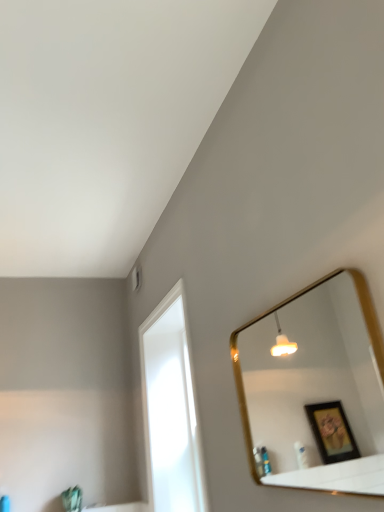
Question: Does gold metallic mirror at upper right have a smaller size compared to transparent glass window at upper left?

Choices:
 (A) yes
 (B) no

Answer: (A)

Question: From the image's perspective, would you say gold metallic mirror at upper right is positioned over transparent glass window at upper left?

Choices:
 (A) yes
 (B) no

Answer: (A)

Question: Is gold metallic mirror at upper right oriented towards transparent glass window at upper left?

Choices:
 (A) no
 (B) yes

Answer: (A)

Question: Is gold metallic mirror at upper right at the left side of transparent glass window at upper left?

Choices:
 (A) no
 (B) yes

Answer: (A)

Question: Is gold metallic mirror at upper right placed right next to transparent glass window at upper left?

Choices:
 (A) no
 (B) yes

Answer: (A)

Question: Would you consider gold metallic mirror at upper right to be distant from transparent glass window at upper left?

Choices:
 (A) yes
 (B) no

Answer: (A)

Question: Could gold metallic mirror at upper right be considered to be inside transparent glass window at upper left?

Choices:
 (A) no
 (B) yes

Answer: (A)

Question: Considering the relative sizes of transparent glass window at upper left and gold metallic mirror at upper right in the image provided, is transparent glass window at upper left taller than gold metallic mirror at upper right?

Choices:
 (A) yes
 (B) no

Answer: (A)

Question: Considering the relative positions of transparent glass window at upper left and gold metallic mirror at upper right in the image provided, is transparent glass window at upper left to the left of gold metallic mirror at upper right from the viewer's perspective?

Choices:
 (A) no
 (B) yes

Answer: (B)

Question: Does transparent glass window at upper left have a smaller size compared to gold metallic mirror at upper right?

Choices:
 (A) yes
 (B) no

Answer: (B)

Question: Is transparent glass window at upper left with gold metallic mirror at upper right?

Choices:
 (A) yes
 (B) no

Answer: (B)

Question: Is transparent glass window at upper left not within gold metallic mirror at upper right?

Choices:
 (A) yes
 (B) no

Answer: (A)

Question: In terms of height, does gold metallic mirror at upper right look taller or shorter compared to transparent glass window at upper left?

Choices:
 (A) tall
 (B) short

Answer: (B)